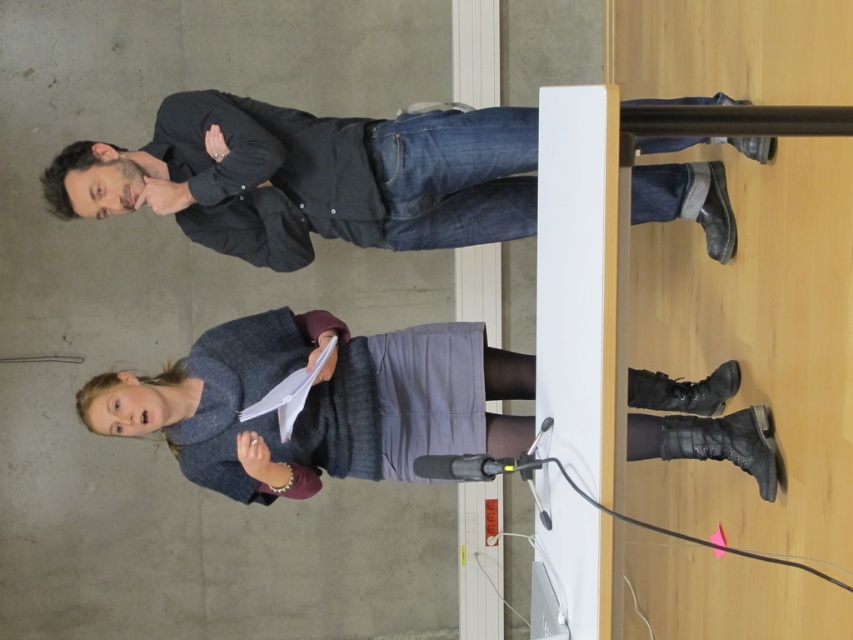
You are an event organizer who needs to adjust seating arrangements. You see the dark gray shirt at upper left and the gray wool skirt at center. Which one is blocking the view of the other?

The dark gray shirt at upper left is in front of gray wool skirt at center, so it is blocking the view of the gray wool skirt at center.

You are attending a presentation and need to identify the speaker. Based on their position relative to the gray wool skirt at center, is the dark gray shirt at upper left located to the left or right of it?

The dark gray shirt at upper left is positioned on the left side of gray wool skirt at center, so it is located to the left of the skirt.

You are attending a presentation and need to identify the position of the two presenters. Which of the two, the dark gray shirt at upper left or the gray wool skirt at center, is located higher in the image?

The dark gray shirt at upper left is located higher in the image than the gray wool skirt at center.